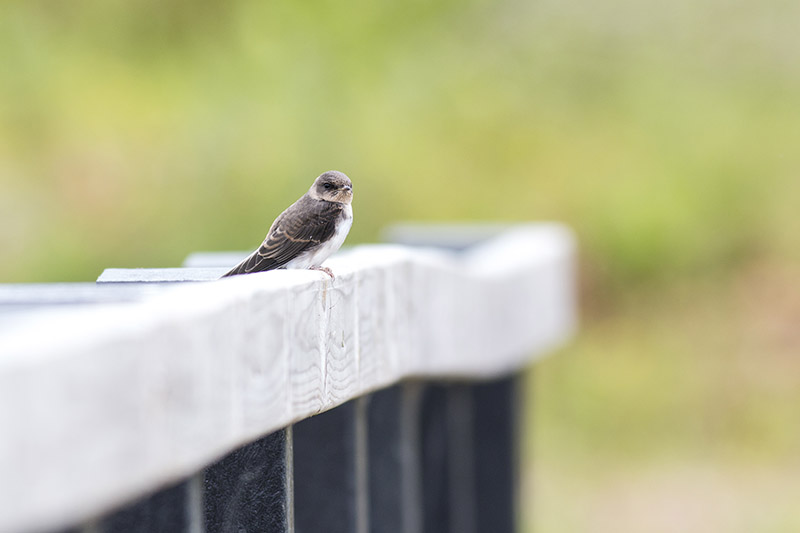
This screenshot has width=800, height=533. Find the location of `wooden supports`. wooden supports is located at coordinates (178, 503), (260, 483), (330, 453), (402, 425), (448, 421), (502, 411).